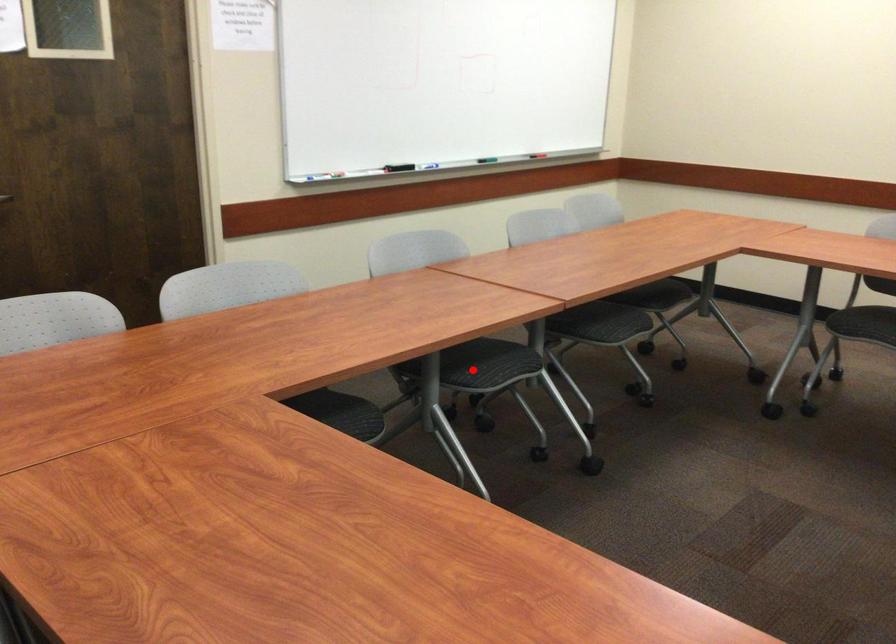
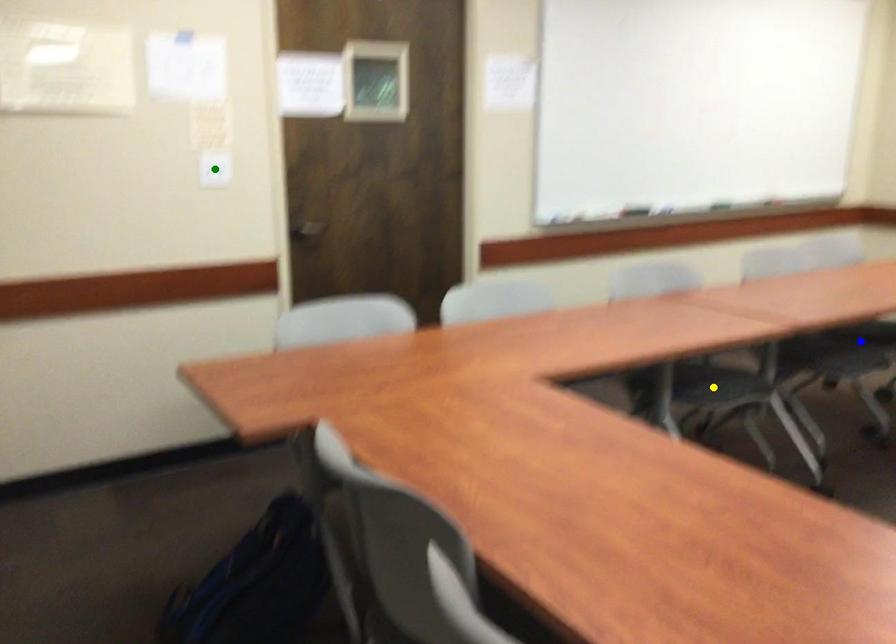
Question: I am providing you with two images of the same scene from different viewpoints. A red point is marked on the first image. You are given multiple points on the second image. In image 2, which mark is for the same physical point as the one in image 1?

Choices:
 (A) yellow point
 (B) blue point
 (C) green point

Answer: (A)